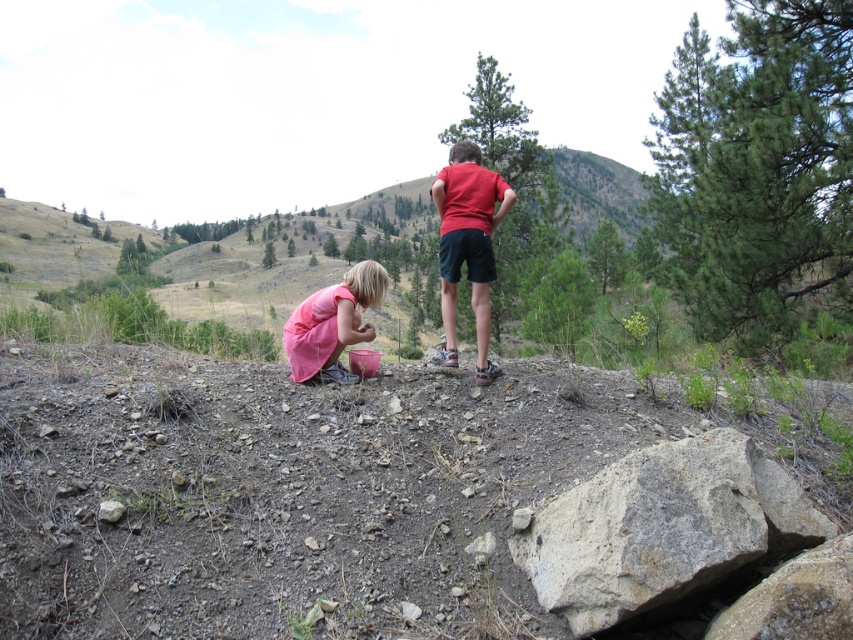
Which is behind, point (785, 486) or point (300, 376)?

The point (300, 376) is more distant.

Which is in front, point (543, 524) or point (366, 300)?

Point (543, 524)

Is point (706, 525) closer to camera compared to point (341, 305)?

Yes.

Find the location of a particular element. This screenshot has width=853, height=640. gray rough rock at lower right is located at coordinates click(x=662, y=528).

Is point (459, 248) behind point (370, 300)?

No, (459, 248) is in front of (370, 300).

This screenshot has height=640, width=853. Find the location of `red matte shirt at center`. red matte shirt at center is located at coordinates (468, 244).

Which is below, gray rough rock at lower right or red matte shirt at center?

gray rough rock at lower right is below.

Based on the photo, which of these two, gray rough rock at lower right or red matte shirt at center, stands shorter?

Standing shorter between the two is gray rough rock at lower right.

Is point (648, 467) less distant than point (468, 189)?

Yes, it is.

Find the location of a particular element. The height and width of the screenshot is (640, 853). gray rough rock at lower right is located at coordinates (662, 528).